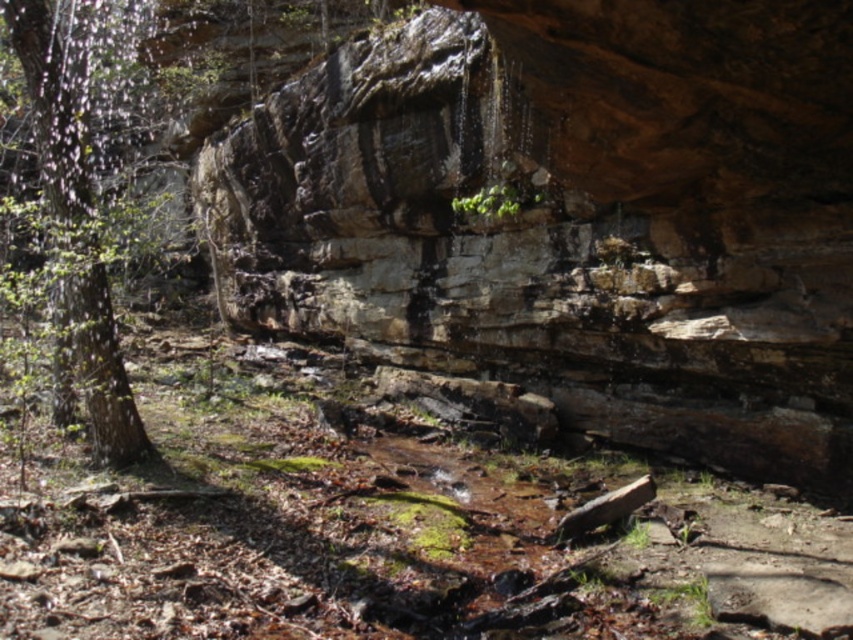
From the picture: Who is taller, rusty stone cliff at center or green rough bark tree at left?

rusty stone cliff at center is taller.

Who is shorter, rusty stone cliff at center or green rough bark tree at left?

green rough bark tree at left is shorter.

Between point (416, 304) and point (108, 390), which one is positioned behind?

The point (416, 304) is behind.

Where is `rusty stone cliff at center`? rusty stone cliff at center is located at coordinates (573, 216).